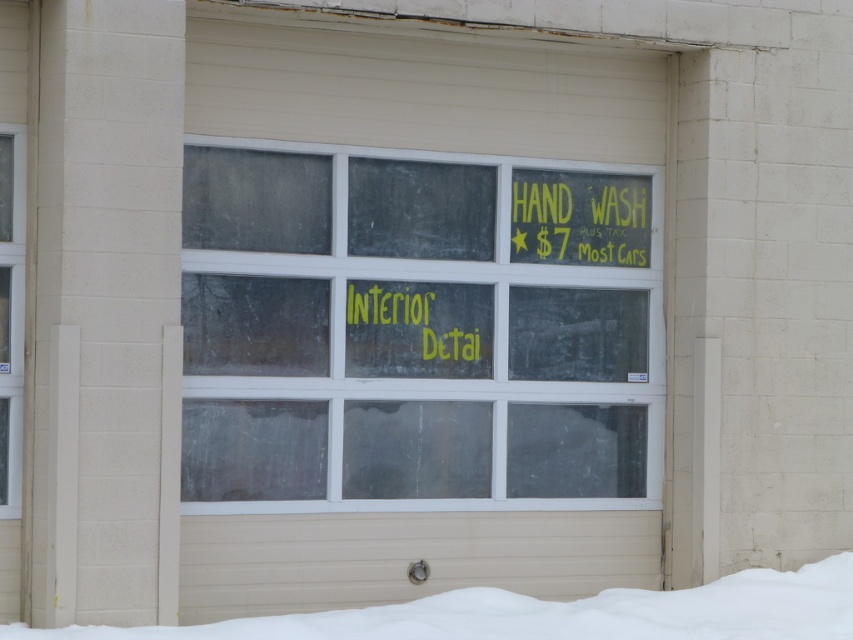
You are a delivery person trying to attach a package to the transparent glass window at center and the yellow chalkboard sign at upper right. The adhesive you have can only stick items within 15 inches of each other. Will the adhesive work for both items?

The transparent glass window at center is 15.35 inches away from the yellow chalkboard sign at upper right. Since the distance exceeds the adhesive limit of 15 inches, the adhesive will not work for both items.